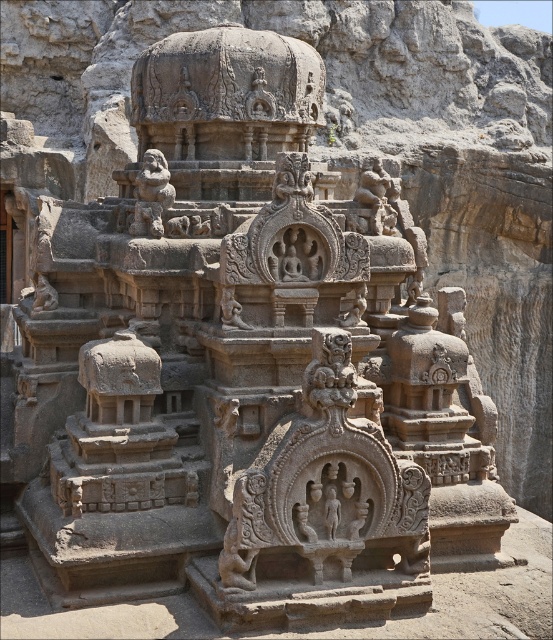
Does dark gray stone statue at center have a greater height compared to rustic stone lion at center?

Incorrect, dark gray stone statue at center's height is not larger of rustic stone lion at center's.

Is point (225, 291) farther from viewer compared to point (50, 289)?

No, (225, 291) is closer to viewer.

At what (x,y) coordinates should I click in order to perform the action: click on dark gray stone statue at center. Please return your answer as a coordinate pair (x, y). Looking at the image, I should click on (232, 310).